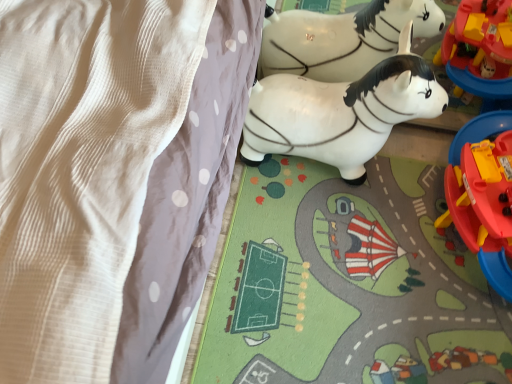
Question: Can you confirm if matte plastic playset at right, which ranks as the first toy in right-to-left order, is wider than white glossy plastic horse at center, which is the second toy in right-to-left order?

Choices:
 (A) yes
 (B) no

Answer: (A)

Question: Considering the relative sizes of matte plastic playset at right, the second toy viewed from the left, and white glossy plastic horse at center, marked as the 1th toy in a left-to-right arrangement, in the image provided, is matte plastic playset at right, the second toy viewed from the left, shorter than white glossy plastic horse at center, marked as the 1th toy in a left-to-right arrangement,?

Choices:
 (A) no
 (B) yes

Answer: (B)

Question: Is matte plastic playset at right, which ranks as the first toy in right-to-left order, completely or partially outside of white glossy plastic horse at center, which is the second toy in right-to-left order?

Choices:
 (A) no
 (B) yes

Answer: (B)

Question: Can you confirm if matte plastic playset at right, which ranks as the first toy in right-to-left order, is positioned to the right of white glossy plastic horse at center, which is the second toy in right-to-left order?

Choices:
 (A) no
 (B) yes

Answer: (B)

Question: Considering the relative sizes of matte plastic playset at right, the second toy viewed from the left, and white glossy plastic horse at center, which is the second toy in right-to-left order, in the image provided, is matte plastic playset at right, the second toy viewed from the left, bigger than white glossy plastic horse at center, which is the second toy in right-to-left order,?

Choices:
 (A) no
 (B) yes

Answer: (B)

Question: Does point (348, 130) appear closer or farther from the camera than point (173, 72)?

Choices:
 (A) closer
 (B) farther

Answer: (B)

Question: In the image, is white glossy plastic horse at center, which is the second toy in right-to-left order, on the left side or the right side of white textured blanket at upper left?

Choices:
 (A) left
 (B) right

Answer: (B)

Question: Do you think white glossy plastic horse at center, which is the second toy in right-to-left order, is within white textured blanket at upper left, or outside of it?

Choices:
 (A) outside
 (B) inside

Answer: (A)

Question: Considering the positions of white glossy plastic horse at center, marked as the 1th toy in a left-to-right arrangement, and white textured blanket at upper left in the image, is white glossy plastic horse at center, marked as the 1th toy in a left-to-right arrangement, wider or thinner than white textured blanket at upper left?

Choices:
 (A) wide
 (B) thin

Answer: (B)

Question: From the image's perspective, is matte plastic playset at right, the second toy viewed from the left, above or below white textured blanket at upper left?

Choices:
 (A) above
 (B) below

Answer: (B)

Question: Based on their positions, is matte plastic playset at right, the second toy viewed from the left, located to the left or right of white textured blanket at upper left?

Choices:
 (A) left
 (B) right

Answer: (B)

Question: From a real-world perspective, is matte plastic playset at right, the second toy viewed from the left, physically located above or below white textured blanket at upper left?

Choices:
 (A) above
 (B) below

Answer: (B)

Question: In the image, is matte plastic playset at right, which ranks as the first toy in right-to-left order, positioned in front of or behind white textured blanket at upper left?

Choices:
 (A) front
 (B) behind

Answer: (B)

Question: Looking at their shapes, would you say white glossy plastic horse at center, which is the second toy in right-to-left order, is wider or thinner than matte plastic playset at right, the second toy viewed from the left?

Choices:
 (A) thin
 (B) wide

Answer: (A)

Question: From a real-world perspective, is white glossy plastic horse at center, marked as the 1th toy in a left-to-right arrangement, positioned above or below matte plastic playset at right, the second toy viewed from the left?

Choices:
 (A) below
 (B) above

Answer: (B)